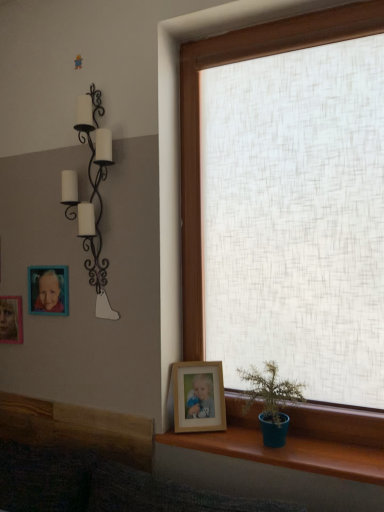
Identify the location of empty space that is ontop of teak wood window sill at lower right (from a real-world perspective). The width and height of the screenshot is (384, 512). (268, 442).